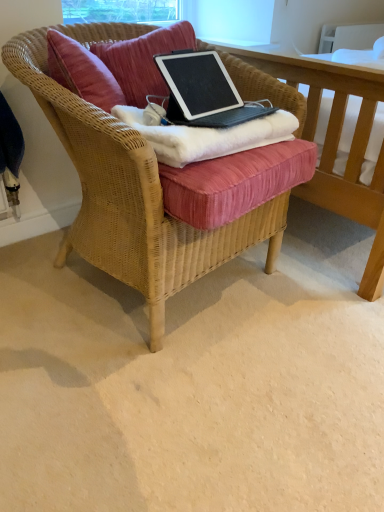
Question: Which is correct: white fluffy blanket at center is inside velvet cushion at center, or outside of it?

Choices:
 (A) outside
 (B) inside

Answer: (A)

Question: Considering the positions of point (148, 123) and point (145, 98), is point (148, 123) closer or farther from the camera than point (145, 98)?

Choices:
 (A) closer
 (B) farther

Answer: (A)

Question: Based on their relative distances, which object is nearer to the black matte laptop at center?

Choices:
 (A) white fluffy blanket at center
 (B) velvet cushion at center
 (C) woven wicker chair at center
 (D) wooden bed frame at upper right

Answer: (A)

Question: Considering the real-world distances, which object is closest to the woven wicker chair at center?

Choices:
 (A) wooden bed frame at upper right
 (B) white fluffy blanket at center
 (C) black matte laptop at center
 (D) velvet cushion at center

Answer: (B)